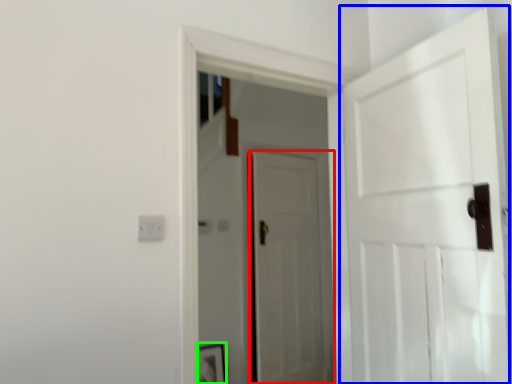
Question: Which object is positioned farthest from door (highlighted by a red box)? Select from door (highlighted by a blue box) and picture frame (highlighted by a green box).

Choices:
 (A) door
 (B) picture frame

Answer: (A)